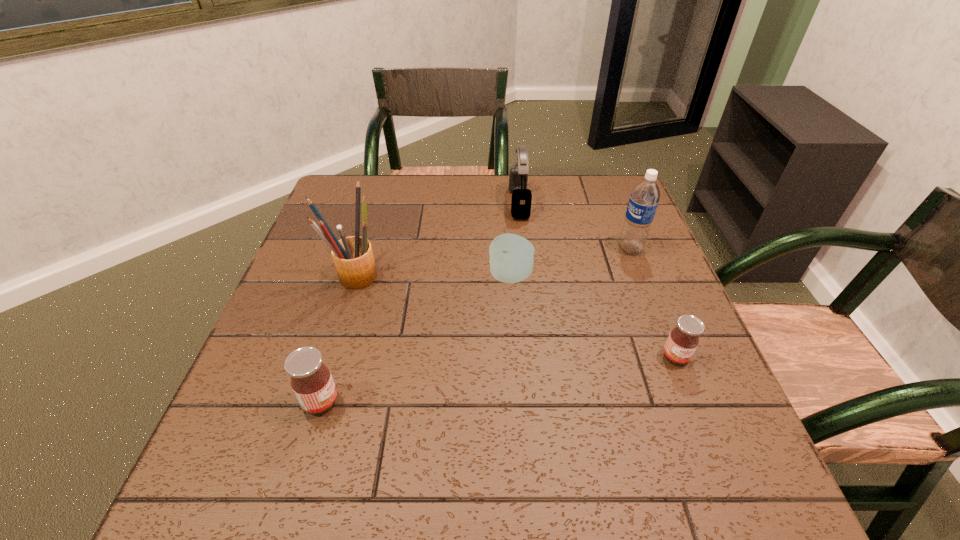
Locate an element on the screen. vacant space situated 0.100m on the label side of the right jam is located at coordinates (698, 414).

The width and height of the screenshot is (960, 540). Find the location of `vacant space located 0.350m on the headband of the headset`. vacant space located 0.350m on the headband of the headset is located at coordinates (391, 203).

Identify the location of free space located 0.210m on the headband of the headset. The width and height of the screenshot is (960, 540). (439, 203).

What are the coordinates of `free space located on the headband of the headset` in the screenshot? It's located at (425, 203).

Where is `vacant region located on the left of the apple`? The width and height of the screenshot is (960, 540). vacant region located on the left of the apple is located at coordinates (386, 276).

Find the location of a particular element. The height and width of the screenshot is (540, 960). vacant area situated on the front of the pencil box is located at coordinates (337, 336).

Locate an element on the screen. Image resolution: width=960 pixels, height=540 pixels. blank space located on the back of the water bottle is located at coordinates (619, 221).

The image size is (960, 540). I want to click on object that is at the far edge, so point(521,200).

Find the location of a particular element. object located at the near edge is located at coordinates (311, 380).

At what (x,y) coordinates should I click in order to perform the action: click on jam that is at the left edge. Please return your answer as a coordinate pair (x, y). Looking at the image, I should click on (311, 380).